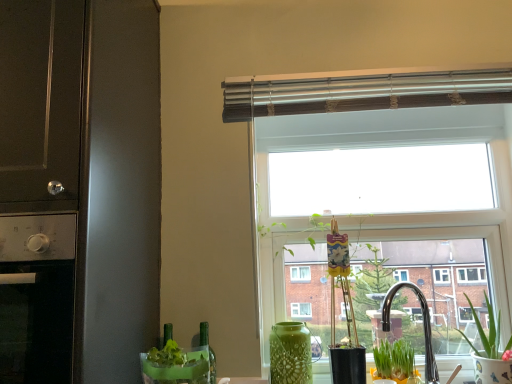
The height and width of the screenshot is (384, 512). Identify the location of vacant space situated above metallic blinds at upper center (from a real-world perspective). (355, 67).